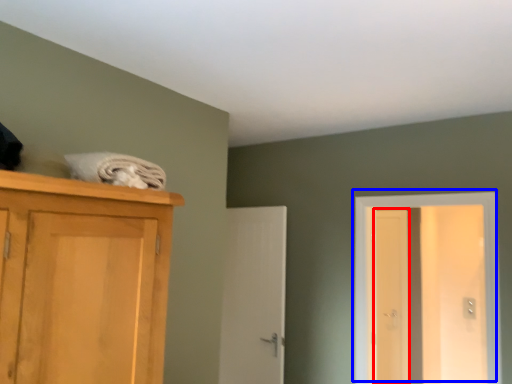
Question: Among these objects, which one is farthest to the camera, screen door (highlighted by a red box) or door (highlighted by a blue box)?

Choices:
 (A) screen door
 (B) door

Answer: (A)